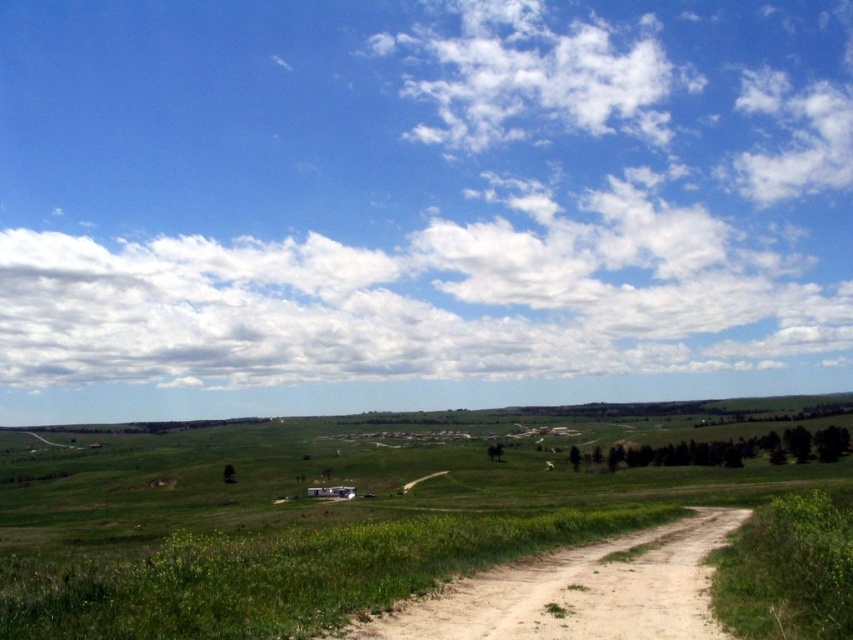
Who is positioned more to the right, green grassy field at center or brown sandy dirt track at lower right?

Positioned to the right is brown sandy dirt track at lower right.

Who is higher up, green grassy field at center or brown sandy dirt track at lower right?

brown sandy dirt track at lower right

Between point (399, 593) and point (556, 564), which one is positioned in front?

Point (399, 593) is in front.

This screenshot has height=640, width=853. Identify the location of green grassy field at center. (303, 522).